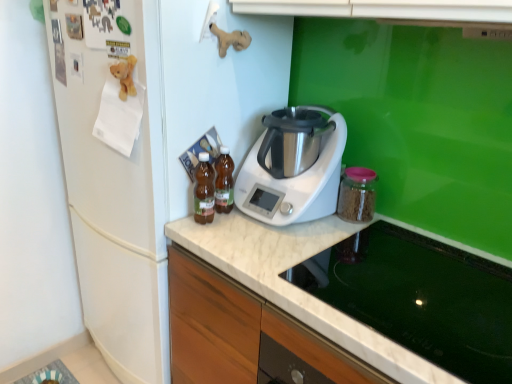
This screenshot has width=512, height=384. Find the location of `vacant area that lies to the right of transparent glass jar at right, the 4th kitchen appliance in the left-to-right sequence`. vacant area that lies to the right of transparent glass jar at right, the 4th kitchen appliance in the left-to-right sequence is located at coordinates (412, 227).